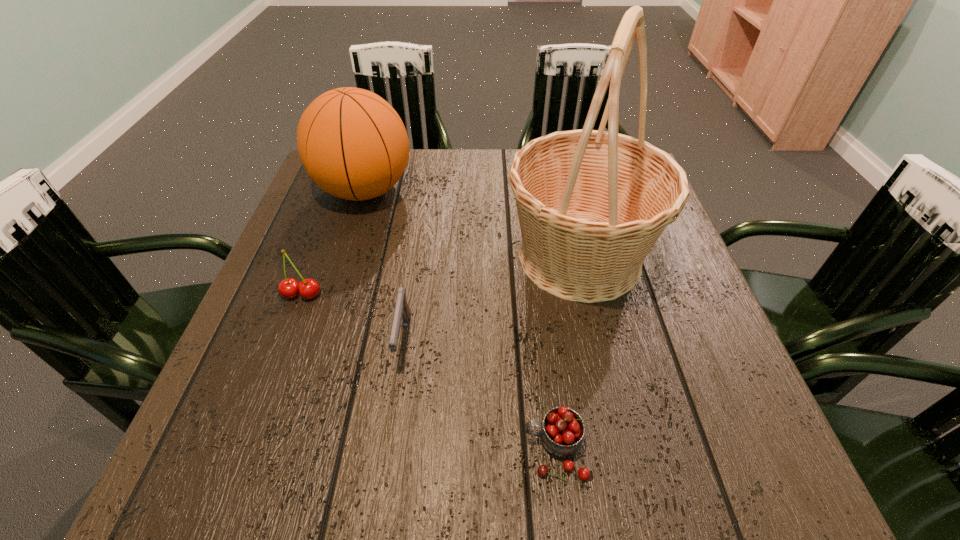
Identify the location of vacant area between the second tallest object and the pistol. This screenshot has width=960, height=540. (384, 265).

At what (x,y) coordinates should I click in order to perform the action: click on empty location between the nearer cherry and the pistol. Please return your answer as a coordinate pair (x, y). The image size is (960, 540). Looking at the image, I should click on (479, 395).

Where is `free space between the right cherry and the second tallest object`? This screenshot has width=960, height=540. free space between the right cherry and the second tallest object is located at coordinates (460, 320).

Locate an element on the screen. This screenshot has width=960, height=540. free point between the left cherry and the fourth shortest object is located at coordinates (333, 242).

The height and width of the screenshot is (540, 960). I want to click on object that is the closest to the tallest object, so click(402, 310).

Select which object appears as the third closest to the basket. Please provide its 2D coordinates. Your answer should be formatted as a tuple, i.e. [(x, y)], where the tuple contains the x and y coordinates of a point satisfying the conditions above.

[(352, 143)]

The height and width of the screenshot is (540, 960). I want to click on vacant space that satisfies the following two spatial constraints: 1. on the handle side of the nearer cherry; 2. on the left side of the tallest object, so click(532, 257).

This screenshot has width=960, height=540. What are the coordinates of `vacant point that satisfies the following two spatial constraints: 1. on the handle side of the nearest object; 2. on the left side of the tallest object` in the screenshot? It's located at (532, 257).

The image size is (960, 540). Find the location of `free location that satisfies the following two spatial constraints: 1. on the handle side of the right cherry; 2. at the barrel of the pistol`. free location that satisfies the following two spatial constraints: 1. on the handle side of the right cherry; 2. at the barrel of the pistol is located at coordinates (542, 340).

Where is `free location that satisfies the following two spatial constraints: 1. with the stems of the farther cherry pointing upwards; 2. on the handle side of the nearer cherry`? Image resolution: width=960 pixels, height=540 pixels. free location that satisfies the following two spatial constraints: 1. with the stems of the farther cherry pointing upwards; 2. on the handle side of the nearer cherry is located at coordinates (244, 450).